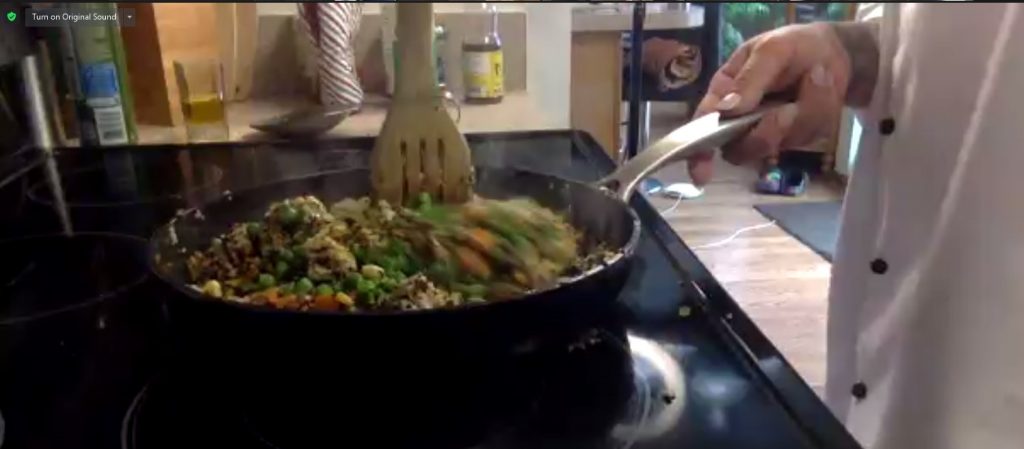
The image size is (1024, 449). Find the location of `bottle`. bottle is located at coordinates [486, 76].